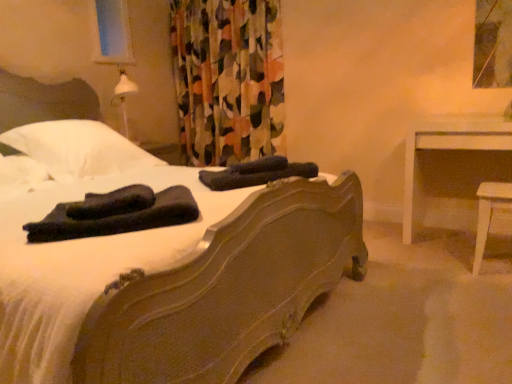
Question: Does white glossy table at right have a greater height compared to brown wooden bed at center?

Choices:
 (A) no
 (B) yes

Answer: (A)

Question: Is brown wooden bed at center located within white glossy table at right?

Choices:
 (A) yes
 (B) no

Answer: (B)

Question: Would you say white glossy table at right is a long distance from brown wooden bed at center?

Choices:
 (A) no
 (B) yes

Answer: (B)

Question: From the image's perspective, is white glossy table at right located above brown wooden bed at center?

Choices:
 (A) no
 (B) yes

Answer: (A)

Question: From a real-world perspective, does white glossy table at right sit lower than brown wooden bed at center?

Choices:
 (A) no
 (B) yes

Answer: (B)

Question: Is white glossy table at right in front of brown wooden bed at center?

Choices:
 (A) no
 (B) yes

Answer: (A)

Question: From a real-world perspective, is brown wooden bed at center under floral fabric curtain at upper center?

Choices:
 (A) no
 (B) yes

Answer: (B)

Question: Is brown wooden bed at center thinner than floral fabric curtain at upper center?

Choices:
 (A) no
 (B) yes

Answer: (A)

Question: Is floral fabric curtain at upper center completely or partially inside brown wooden bed at center?

Choices:
 (A) yes
 (B) no

Answer: (B)

Question: From a real-world perspective, is brown wooden bed at center positioned over floral fabric curtain at upper center based on gravity?

Choices:
 (A) yes
 (B) no

Answer: (B)

Question: Considering the relative positions of brown wooden bed at center and floral fabric curtain at upper center in the image provided, is brown wooden bed at center to the left of floral fabric curtain at upper center from the viewer's perspective?

Choices:
 (A) yes
 (B) no

Answer: (A)

Question: Is brown wooden bed at center positioned beyond the bounds of floral fabric curtain at upper center?

Choices:
 (A) yes
 (B) no

Answer: (A)

Question: Is dark blue fabric at center, which is the first material from back to front, located within white glossy table at right?

Choices:
 (A) no
 (B) yes

Answer: (A)